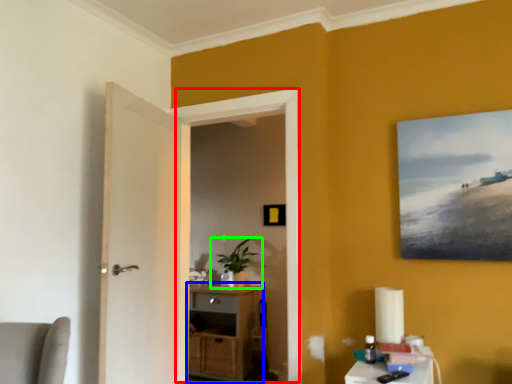
Question: Which object is the farthest from window (highlighted by a red box)? Choose among these: cabinetry (highlighted by a blue box) or houseplant (highlighted by a green box).

Choices:
 (A) cabinetry
 (B) houseplant

Answer: (B)